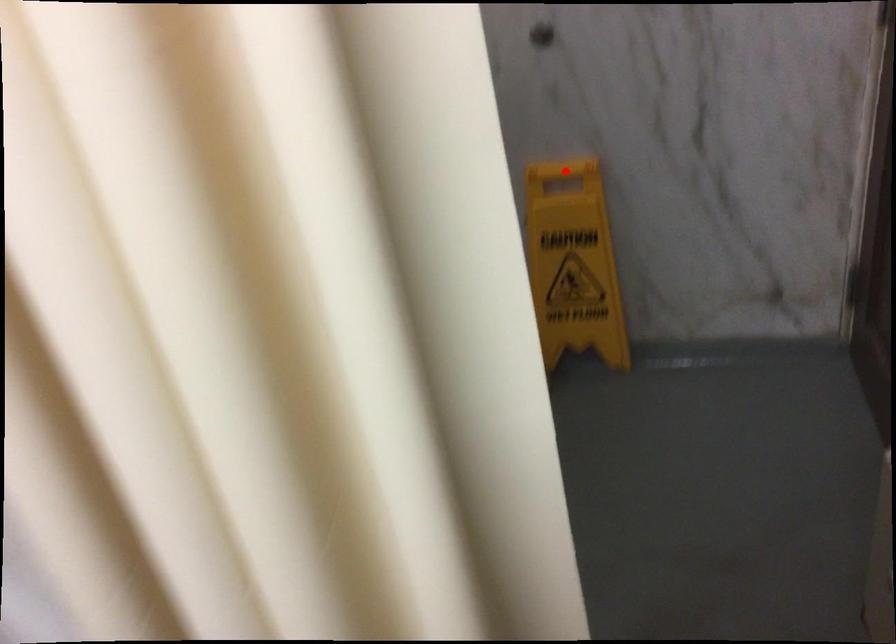
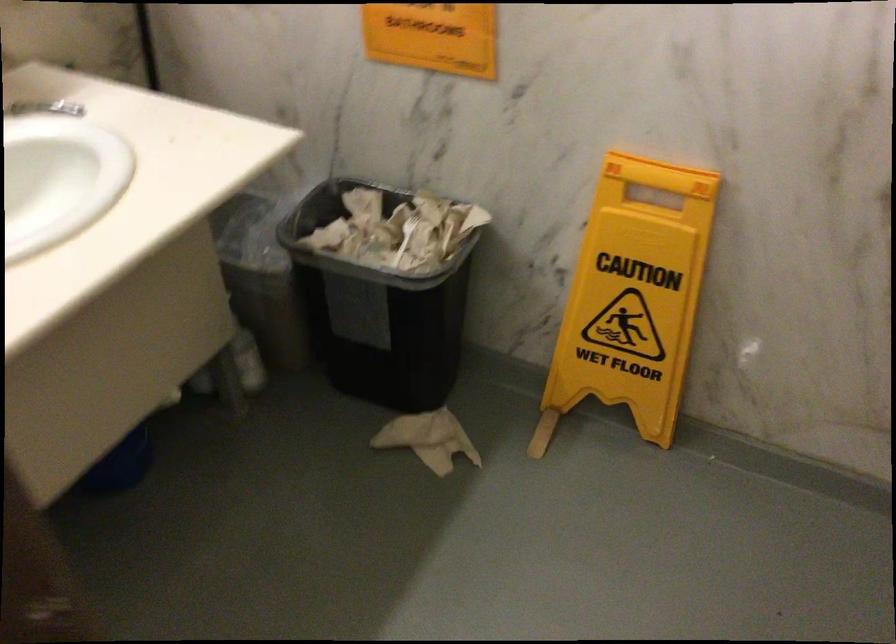
Locate, in the second image, the point that corresponds to the highlighted location in the first image.

(659, 175)